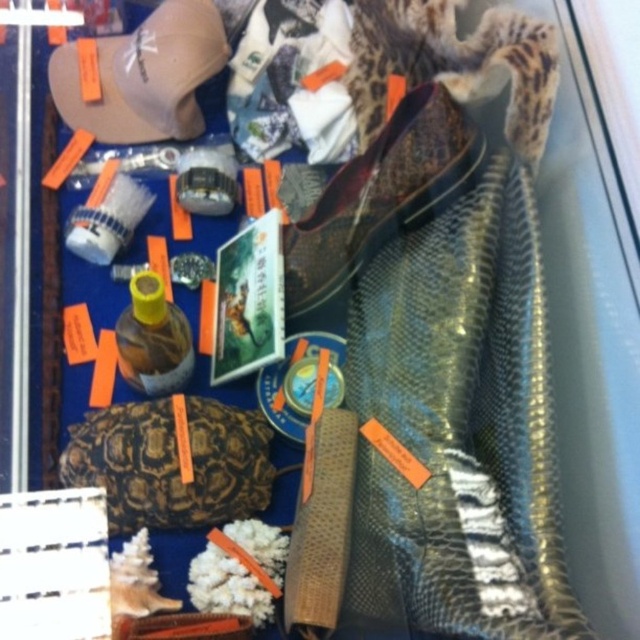
Question: Is leather-textured purse at center below leather shoe at center?

Choices:
 (A) no
 (B) yes

Answer: (B)

Question: Which object is farther from the camera taking this photo?

Choices:
 (A) yellow matte bottle at center-left
 (B) leather-textured purse at center

Answer: (B)

Question: Which point appears farthest from the camera in this image?

Choices:
 (A) (157, 28)
 (B) (465, 145)

Answer: (A)

Question: Is leather-textured purse at center in front of beige fabric baseball cap at upper left?

Choices:
 (A) yes
 (B) no

Answer: (A)

Question: Does leather-textured purse at center have a greater width compared to yellow matte bottle at center-left?

Choices:
 (A) no
 (B) yes

Answer: (B)

Question: Which object is farther from the camera taking this photo?

Choices:
 (A) beige fabric baseball cap at upper left
 (B) leather shoe at center
 (C) yellow matte bottle at center-left
 (D) leather-textured purse at center

Answer: (A)